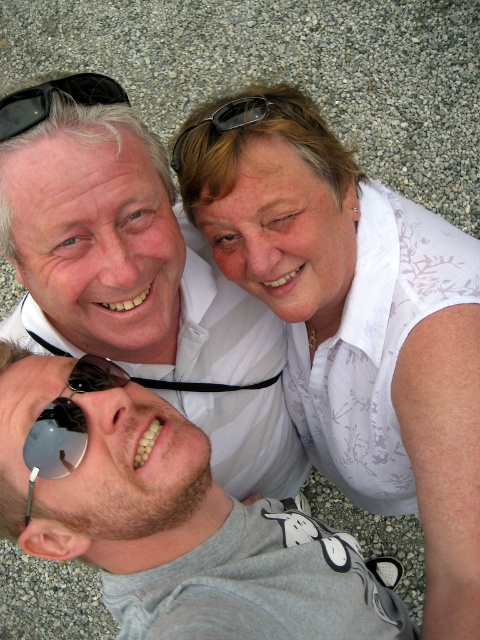
You are a photographer trying to adjust the composition of the image. You need to know the position of the sunglasses at lower left and the black plastic sunglasses at upper center. Which of these two items is located lower in the image?

The sunglasses at lower left is positioned under black plastic sunglasses at upper center, so the sunglasses at lower left is located lower in the image.